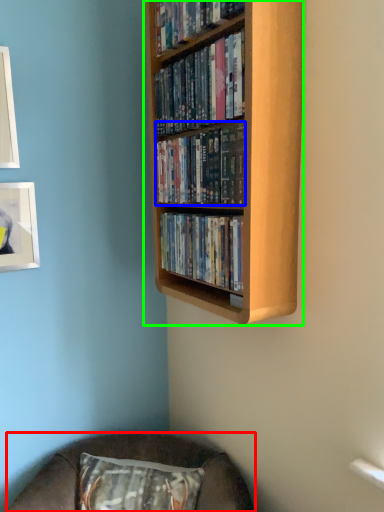
Question: Considering the real-world distances, which object is farthest from furniture (highlighted by a red box)? book (highlighted by a blue box) or bookcase (highlighted by a green box)?

Choices:
 (A) book
 (B) bookcase

Answer: (A)